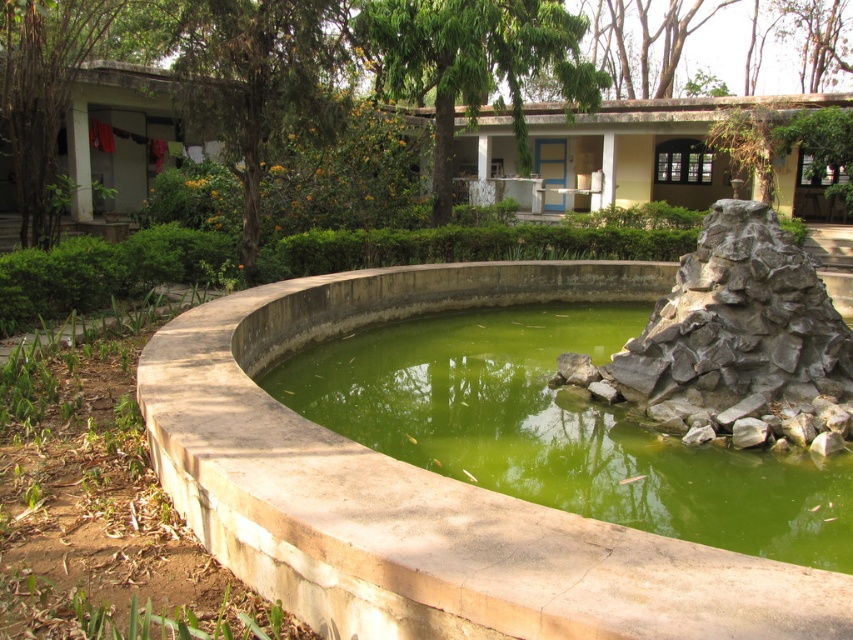
You are standing at the point labeled as point [558,432] in the image. Which object is exactly at your current location?

The green concrete pond at center is located at point [558,432], so the object exactly at your current location is the green concrete pond at center.

You are standing on the path near the gray rock formation at right and want to see the green concrete pond at center. Which direction should you move to get a clear view of the pond?

You should move forward because the gray rock formation at right is behind the green concrete pond at center, so moving forward will allow you to see the pond more clearly by moving around the rock formation.

You are a landscape architect designing a garden and want to place a new statue between the green concrete pond at center and the gray rock formation at right. Which object should the statue be closer to if it needs to be closer to the smaller one?

The statue should be closer to the green concrete pond at center because it is smaller than the gray rock formation at right.